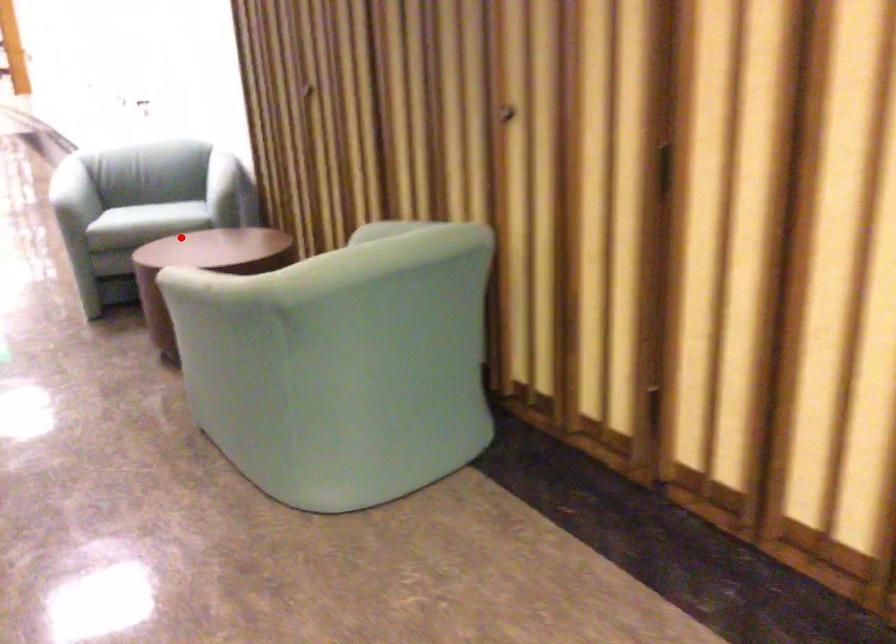
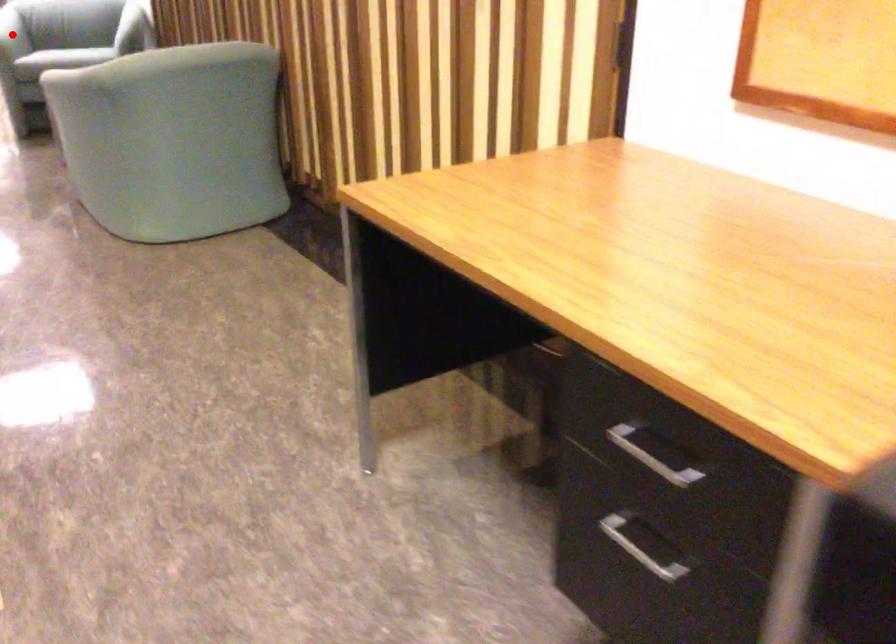
I am providing you with two images of the same scene from different viewpoints. A red point is marked on the first image and another point is marked on the second image. Do the highlighted points in image1 and image2 indicate the same real-world spot?

No